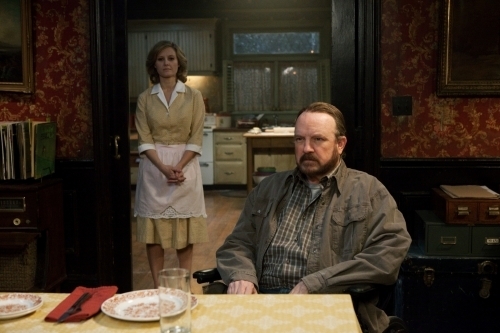
Where is `glass`? glass is located at coordinates (183, 319).